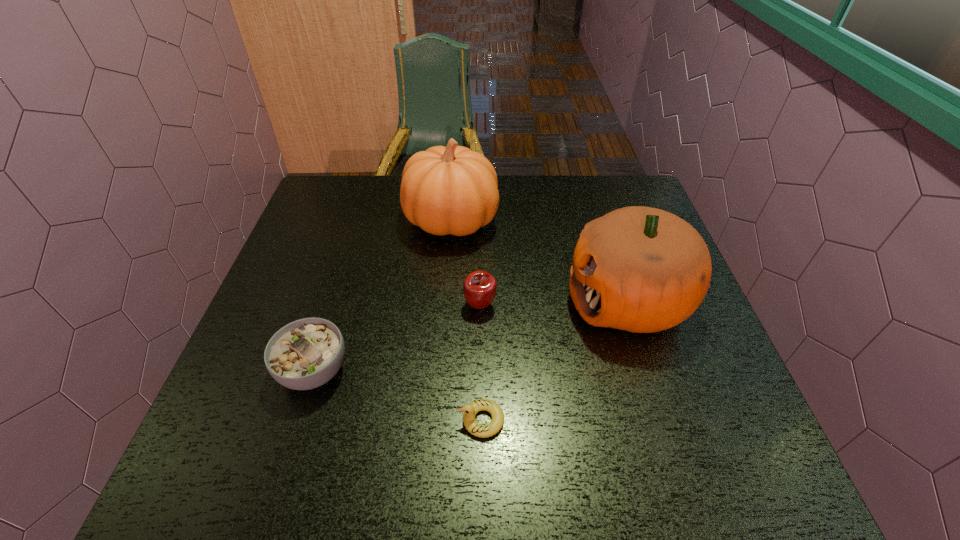
Where is `free space located on the face of the right pumpkin`? The width and height of the screenshot is (960, 540). free space located on the face of the right pumpkin is located at coordinates (495, 300).

You are a GUI agent. You are given a task and a screenshot of the screen. Output one action in this format:
    pyautogui.click(x=<x>, y=<y>)
    Task: Click on the vacant area situated on the right of the apple
    This screenshot has width=960, height=540.
    Given the screenshot: What is the action you would take?
    pyautogui.click(x=550, y=305)

Identify the location of vacant space located 0.050m on the left of the soup bowl. The height and width of the screenshot is (540, 960). (254, 370).

In order to click on vacant space located on the face of the duckling in this screenshot , I will do `click(340, 420)`.

Identify the location of vacant space located 0.290m on the face of the duckling. (309, 420).

Identify the location of vacant space situated 0.270m on the face of the duckling. (320, 420).

The width and height of the screenshot is (960, 540). Find the location of `object present at the far edge`. object present at the far edge is located at coordinates (453, 190).

This screenshot has height=540, width=960. I want to click on object at the left edge, so click(305, 354).

I want to click on object that is at the right edge, so click(640, 269).

In the image, there is a desktop. Identify the location of vacant space at the far edge. (502, 200).